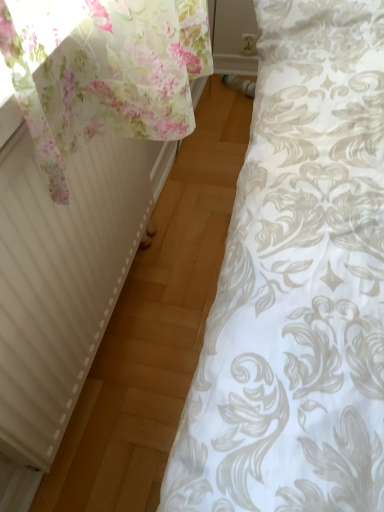
Describe the element at coordinates (61, 280) in the screenshot. Image resolution: width=384 pixels, height=512 pixels. I see `white textured radiator at left` at that location.

What is the approximate height of white textured radiator at left?

white textured radiator at left is 20.31 inches tall.

Image resolution: width=384 pixels, height=512 pixels. What are the coordinates of `white textured radiator at left` in the screenshot? It's located at (61, 280).

This screenshot has height=512, width=384. Identify the location of white textured radiator at left. point(61,280).